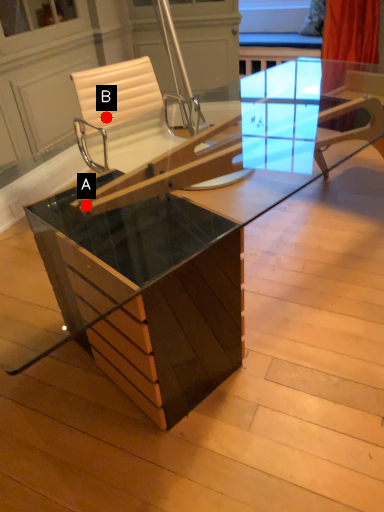
Question: Two points are circled on the image, labeled by A and B beside each circle. Which of the following is the farthest from the observer?

Choices:
 (A) A is further
 (B) B is further

Answer: (B)